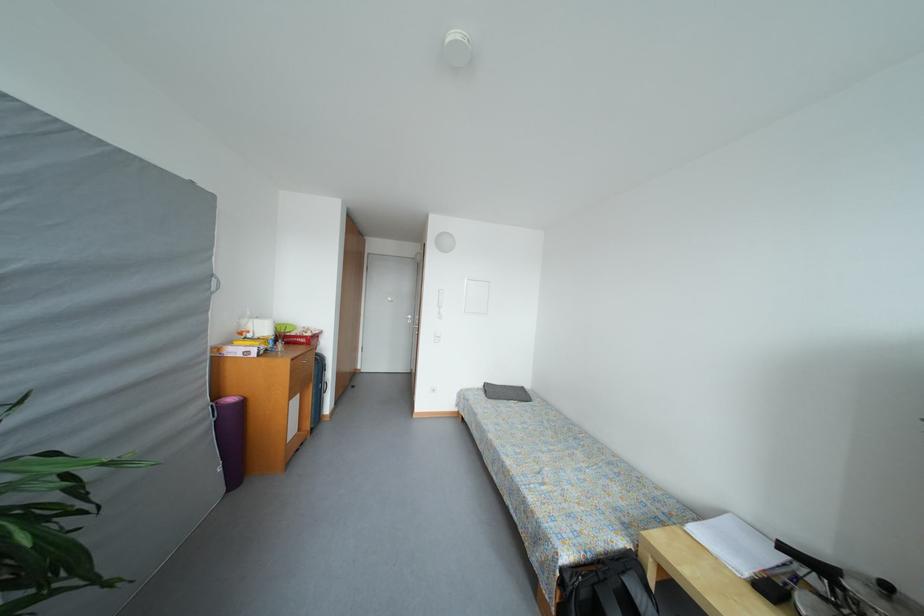
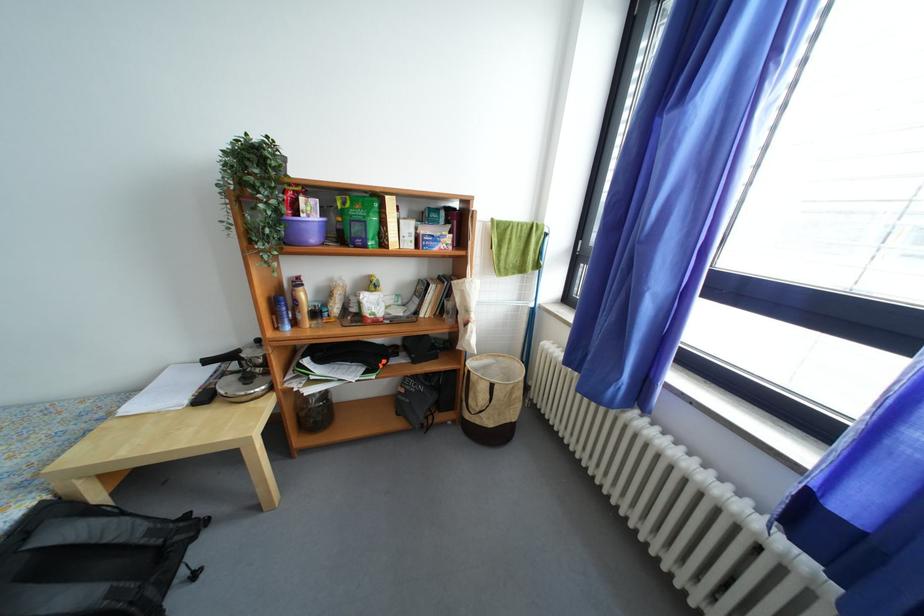
Find the pixel in the second image that matches (752,578) in the first image.

(192, 406)